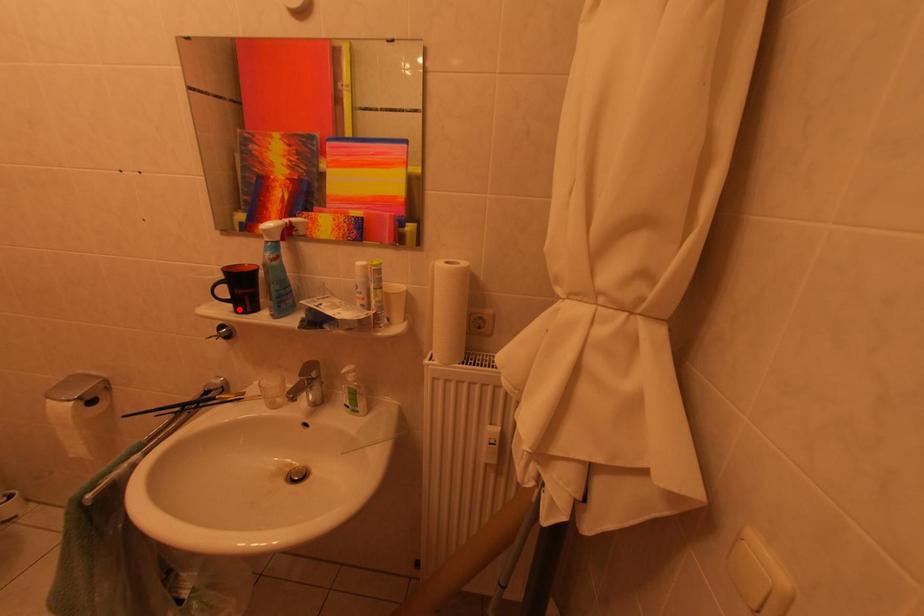
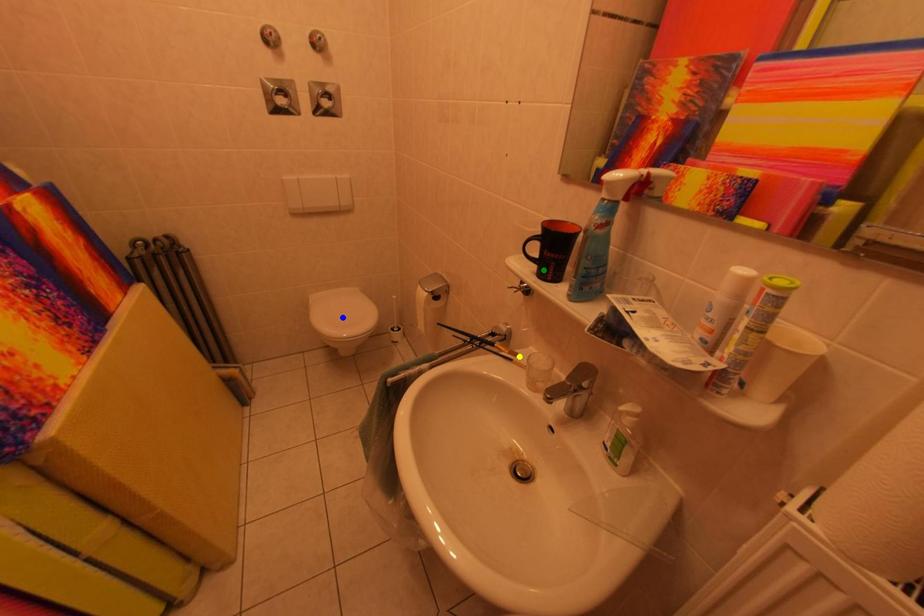
Question: I am providing you with two images of the same scene from different viewpoints. A red point is marked on the first image. You are given multiple points on the second image. Which point in image 2 represents the same 3d spot as the red point in image 1?

Choices:
 (A) green point
 (B) blue point
 (C) yellow point

Answer: (A)